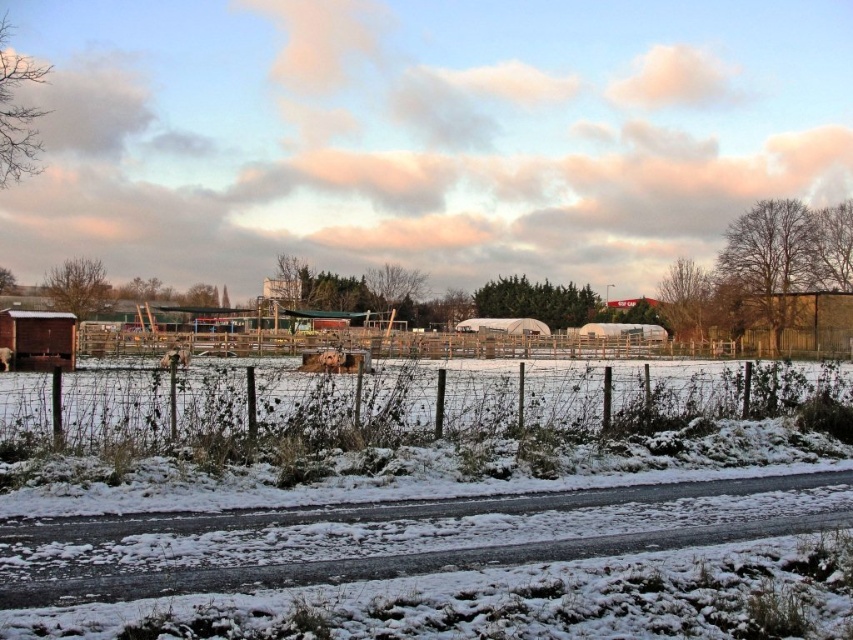
Question: Estimate the real-world distances between objects in this image. Which object is closer to the snow-covered grass at center?

Choices:
 (A) brown wooden hut at left
 (B) wooden fence at right
 (C) wooden fence at center

Answer: (A)

Question: In this image, where is snow-covered grass at center located relative to wooden fence at right?

Choices:
 (A) right
 (B) left

Answer: (B)

Question: Is snow-covered grass at center to the right of wooden fence at center from the viewer's perspective?

Choices:
 (A) yes
 (B) no

Answer: (A)

Question: Among these objects, which one is nearest to the camera?

Choices:
 (A) brown wooden hut at left
 (B) wooden fence at center
 (C) wooden fence at right
 (D) snow-covered grass at center

Answer: (D)

Question: Among these objects, which one is nearest to the camera?

Choices:
 (A) wooden fence at right
 (B) snow-covered grass at center

Answer: (B)

Question: Can you confirm if snow-covered grass at center is positioned above wooden fence at center?

Choices:
 (A) no
 (B) yes

Answer: (A)